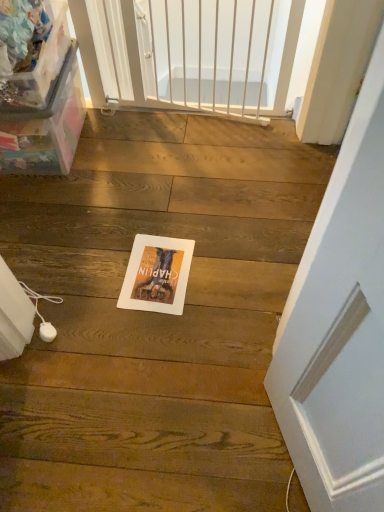
This screenshot has width=384, height=512. I want to click on vacant region above matte paper postcard at center (from a real-world perspective), so click(x=148, y=272).